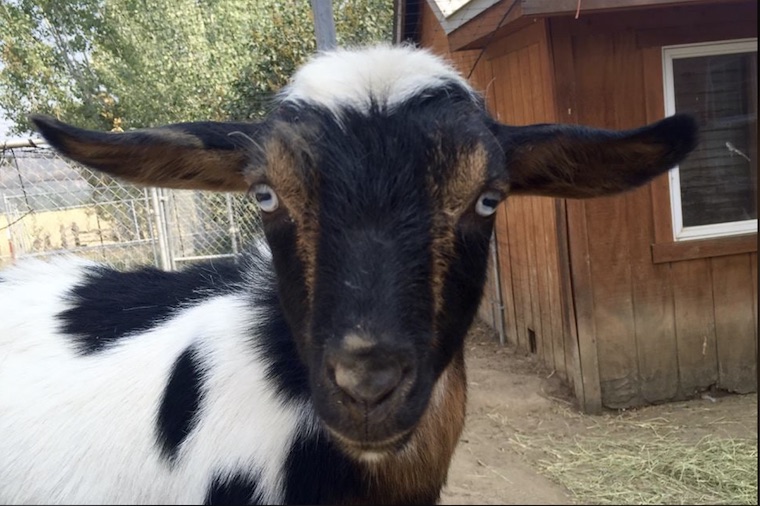
The image size is (760, 506). I want to click on window, so click(x=735, y=137).